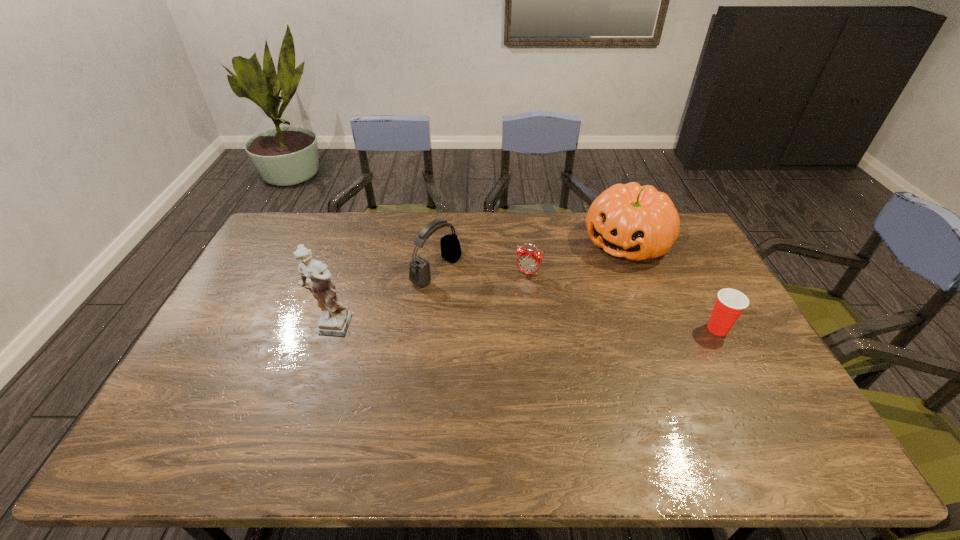
This screenshot has height=540, width=960. I want to click on free space on the desktop that is between the leftmost object and the Dixie cup and is positioned on the headband of the headset, so click(x=544, y=329).

Locate an element on the screen. Image resolution: width=960 pixels, height=540 pixels. free space on the desktop that is between the figurine and the Dixie cup and is positioned on the face of the third object from left to right is located at coordinates (502, 329).

Identify the location of vacant space on the desktop that is between the leftmost object and the Dixie cup and is positioned on the carved face of the pumpkin. (547, 329).